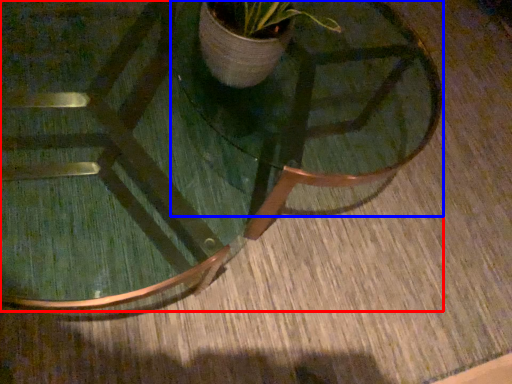
Question: Which of the following is the closest to the observer, coffee table (highlighted by a red box) or round table (highlighted by a blue box)?

Choices:
 (A) coffee table
 (B) round table

Answer: (B)